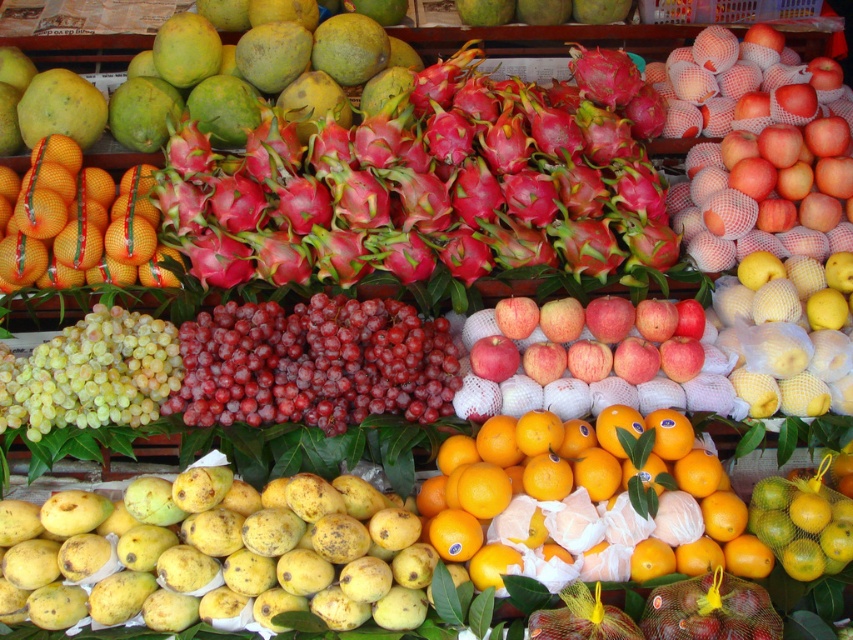
Question: Which object appears closest to the camera in this image?

Choices:
 (A) red matte apples at center
 (B) orangesmoothorange at center
 (C) yellow matte mango at lower left

Answer: (C)

Question: Which point is farther to the camera?

Choices:
 (A) red matte dragonfruit at center
 (B) orangesmoothorange at center
 (C) orangenettedoranges at left
 (D) red matte apples at center

Answer: (A)

Question: Can you confirm if orangenettedoranges at left is positioned above red matte apples at center?

Choices:
 (A) yes
 (B) no

Answer: (A)

Question: Which point appears farthest from the camera in this image?

Choices:
 (A) (93, 198)
 (B) (201, 259)
 (C) (640, 474)

Answer: (A)

Question: Considering the relative positions of red matte dragonfruit at center and orangesmoothorange at center in the image provided, where is red matte dragonfruit at center located with respect to orangesmoothorange at center?

Choices:
 (A) right
 (B) left

Answer: (B)

Question: Is red matte dragonfruit at center above orangesmoothorange at center?

Choices:
 (A) yes
 (B) no

Answer: (A)